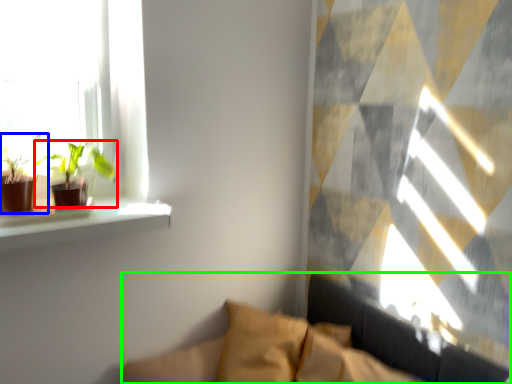
Question: Which object is positioned farthest from houseplant (highlighted by a red box)? Select from houseplant (highlighted by a blue box) and couch (highlighted by a green box).

Choices:
 (A) houseplant
 (B) couch

Answer: (B)